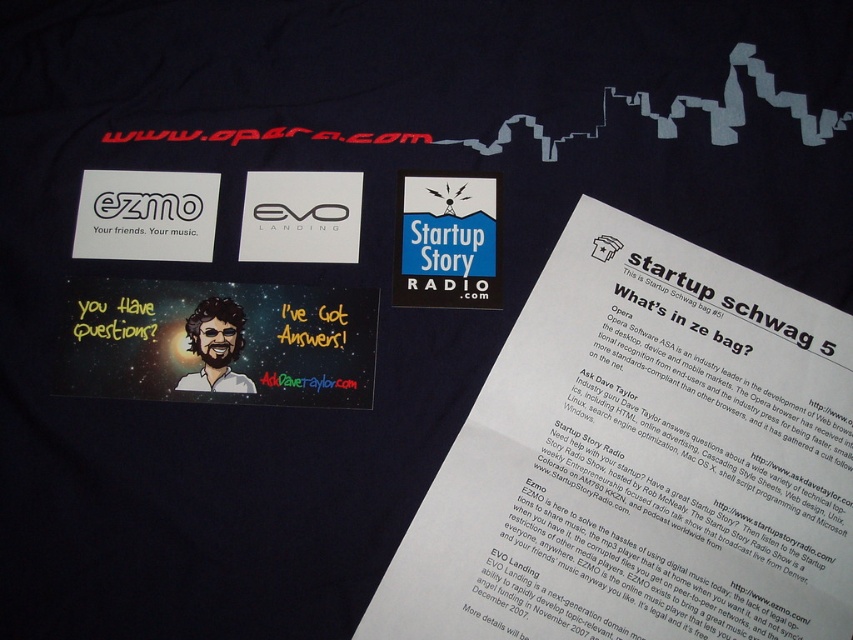
You are designing a layout for a new tshirt and want to place a blue paper sticker at the exact center of the shirt. However, you notice there is already a blue paper sticker at center. Where should you place your new sticker to avoid overlapping?

The blue paper sticker at center is already located at point (445, 241), so you should place your new sticker somewhere else to avoid overlapping.

You are holding a blue paper sticker at center that is 20.71 inches away from you. You want to place it on a wall that is 30 inches wide. Will the sticker fit horizontally on the wall without overlapping the edges?

The blue paper sticker at center is 20.71 inches away from the viewer, but the distance does not indicate its size. The question cannot be answered with the provided information.